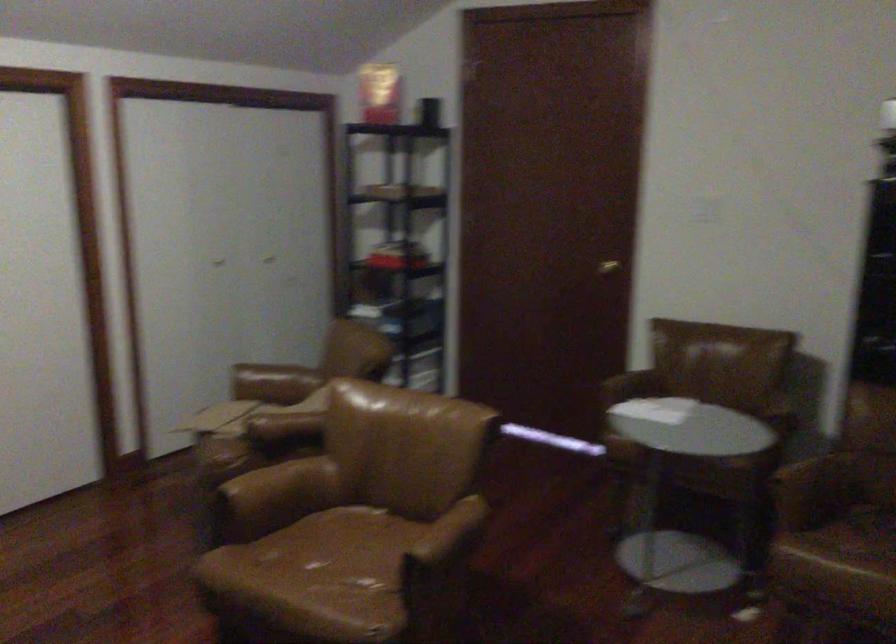
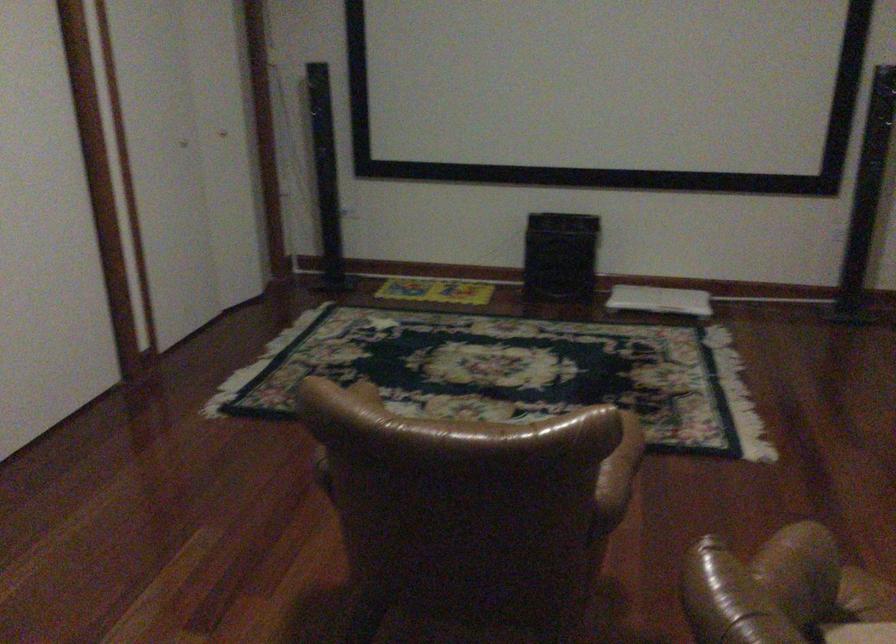
Question: I am providing you with two images of the same scene from different viewpoints. After the viewpoint changes to image2, which objects are now occluded?

Choices:
 (A) brown chair sitting surface
 (B) black speaker box
 (C) brown leather armrest
 (D) brown bag strap

Answer: (A)